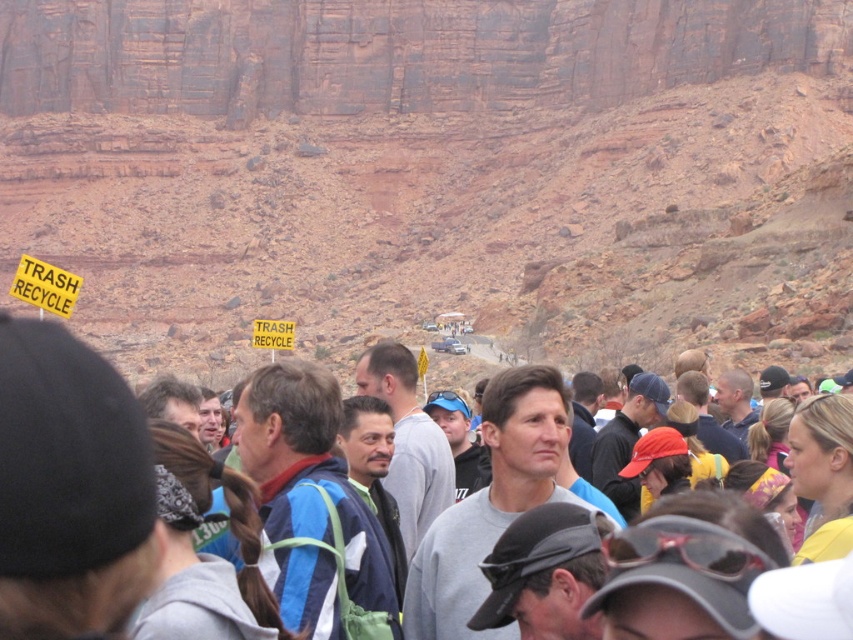
Question: Which point is closer to the camera taking this photo?

Choices:
 (A) (38, 298)
 (B) (273, 324)

Answer: (A)

Question: Which of the following is the farthest from the observer?

Choices:
 (A) yellow paper sign at upper left
 (B) yellow paper sign at center

Answer: (B)

Question: Can you confirm if gray casual clothing at center is positioned below yellow paper sign at center?

Choices:
 (A) yes
 (B) no

Answer: (A)

Question: Which of the following is the farthest from the observer?

Choices:
 (A) (271, 344)
 (B) (106, 486)
 (C) (24, 275)

Answer: (A)

Question: Is yellow paper sign at upper left positioned in front of yellow paper sign at center?

Choices:
 (A) yes
 (B) no

Answer: (A)

Question: In this image, where is yellow paper sign at upper left located relative to yellow paper sign at center?

Choices:
 (A) right
 (B) left

Answer: (B)